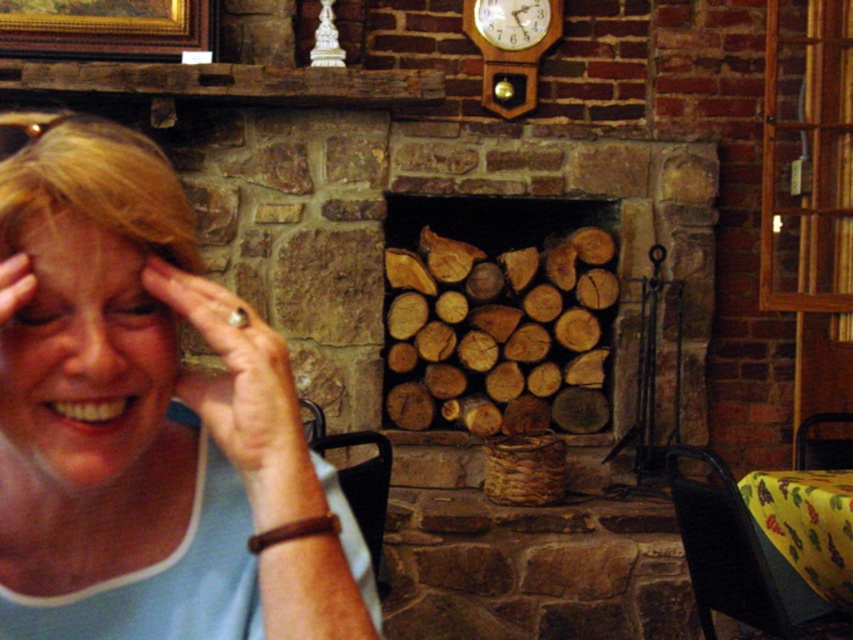
You are an interior designer planning to hang a new picture frame that is 12 inches tall. You have two options for placement near the wooden clock at upper center and the light brown skin at center. Based on their sizes, which object can accommodate the new frame without it looking too small compared to the existing items?

The wooden clock at upper center is much taller than the light brown skin at center, so placing the new 12 inch frame next to the wooden clock at upper center would be better as it won

You are a decorator arranging items in the living room. You have a wooden logs at center and a smooth skin face at left. Which object takes up more space in the scene?

The wooden logs at center is larger in size than smooth skin face at left, so the wooden logs at center takes up more space in the scene.